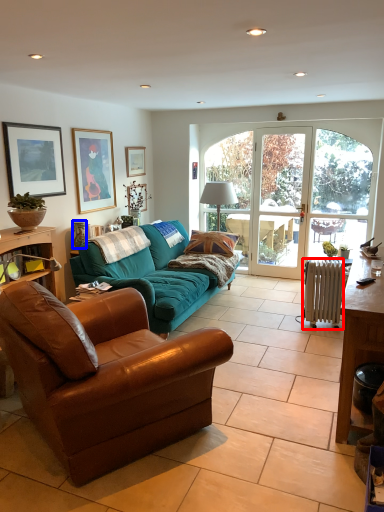
Question: Which object is closer to the camera taking this photo, radiator (highlighted by a red box) or vase (highlighted by a blue box)?

Choices:
 (A) radiator
 (B) vase

Answer: (A)